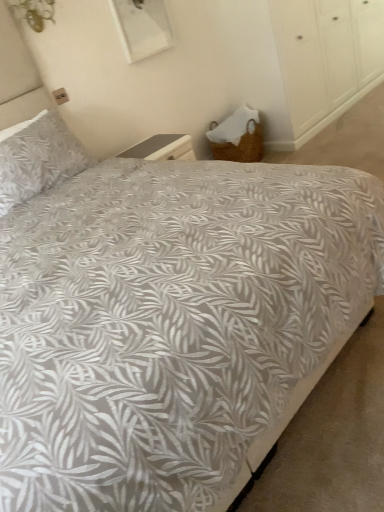
Question: Considering the positions of woven wicker basket at lower right and gray leaf-patterned pillow at upper left in the image, is woven wicker basket at lower right bigger or smaller than gray leaf-patterned pillow at upper left?

Choices:
 (A) big
 (B) small

Answer: (A)

Question: From a real-world perspective, is woven wicker basket at lower right above or below gray leaf-patterned pillow at upper left?

Choices:
 (A) above
 (B) below

Answer: (B)

Question: Considering the positions of point (337, 70) and point (44, 114), is point (337, 70) closer or farther from the camera than point (44, 114)?

Choices:
 (A) closer
 (B) farther

Answer: (B)

Question: From their relative heights in the image, would you say gray leaf-patterned pillow at upper left is taller or shorter than woven wicker basket at lower right?

Choices:
 (A) short
 (B) tall

Answer: (A)

Question: Based on their positions, is gray leaf-patterned pillow at upper left located to the left or right of woven wicker basket at lower right?

Choices:
 (A) right
 (B) left

Answer: (B)

Question: In terms of size, does gray leaf-patterned pillow at upper left appear bigger or smaller than woven wicker basket at lower right?

Choices:
 (A) big
 (B) small

Answer: (B)

Question: In the image, is gray leaf-patterned pillow at upper left positioned in front of or behind woven wicker basket at lower right?

Choices:
 (A) behind
 (B) front

Answer: (B)